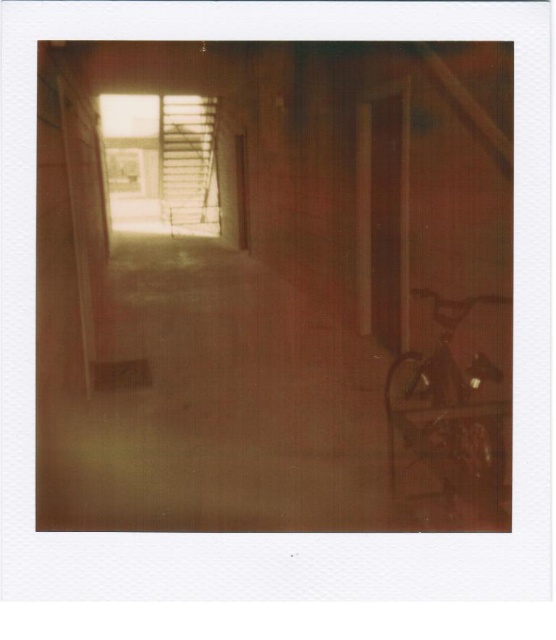
You are standing in a dimly lit space with a partially open door or window at the far end. You see a matte concrete corridor at center. Based on the coordinates provided, can you determine if the corridor is closer to the light source or the entrance?

The coordinates of the matte concrete corridor at center are at point (275,285). Since the light source is coming from the partially open door or window at the far end, the corridor is positioned centrally and not necessarily closer to either the light source or the entrance. However, without additional spatial context, it is difficult to determine its exact proximity to either.